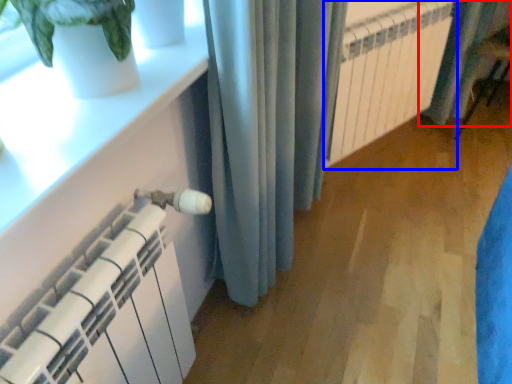
Question: Which object appears farthest to the camera in this image, curtain (highlighted by a red box) or radiator (highlighted by a blue box)?

Choices:
 (A) curtain
 (B) radiator

Answer: (A)